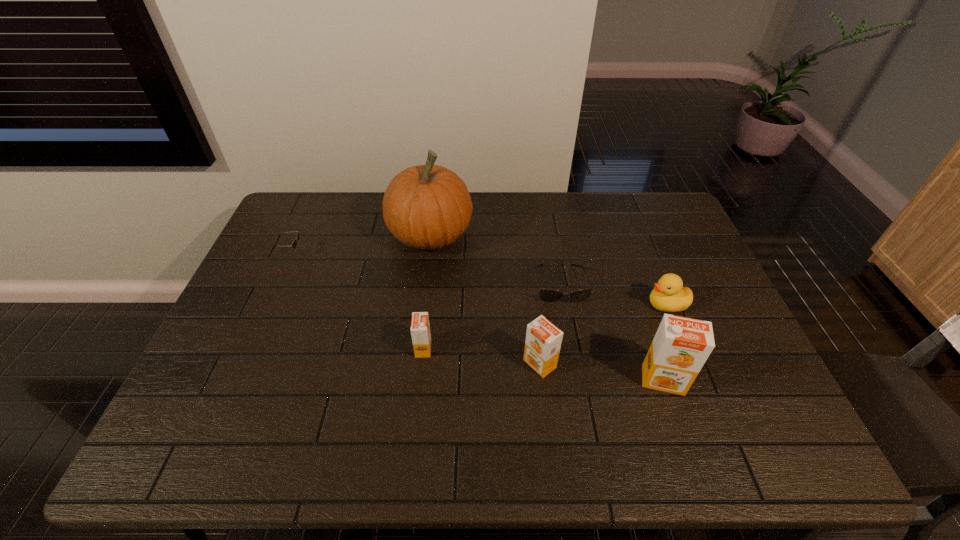
Identify the location of the shorter sunglasses. The width and height of the screenshot is (960, 540). (547, 295).

Identify the location of vacant area located on the back of the shortest orange juice. (435, 242).

Where is `free spot located 0.260m on the left of the second orange juice from left to right`? free spot located 0.260m on the left of the second orange juice from left to right is located at coordinates (421, 364).

Find the location of a particular element. vacant point located on the right of the rightmost orange juice is located at coordinates 763,380.

The height and width of the screenshot is (540, 960). I want to click on vacant space located 0.250m on the stem of the pumpkin, so point(548,235).

Find the location of a particular element. This screenshot has width=960, height=540. blank space located in front of the lenses of the left sunglasses is located at coordinates (428, 254).

Locate an element on the screen. vacant region located on the face of the duckling is located at coordinates (516, 305).

The width and height of the screenshot is (960, 540). What are the coordinates of `vacant space located 0.120m on the face of the duckling` in the screenshot? It's located at (604, 305).

Locate an element on the screen. free space located on the face of the duckling is located at coordinates (596, 305).

Locate an element on the screen. This screenshot has height=540, width=960. free space located 0.120m on the front-facing side of the right sunglasses is located at coordinates (570, 340).